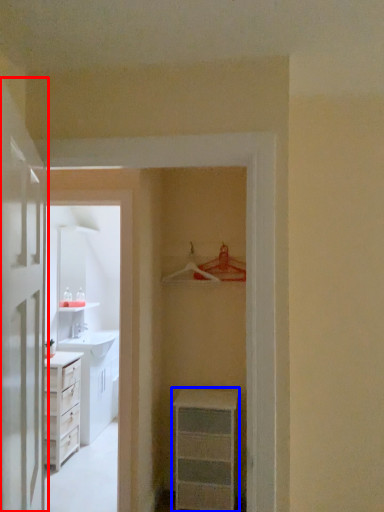
Question: Which point is further to the camera, door (highlighted by a red box) or chest of drawers (highlighted by a blue box)?

Choices:
 (A) door
 (B) chest of drawers

Answer: (B)